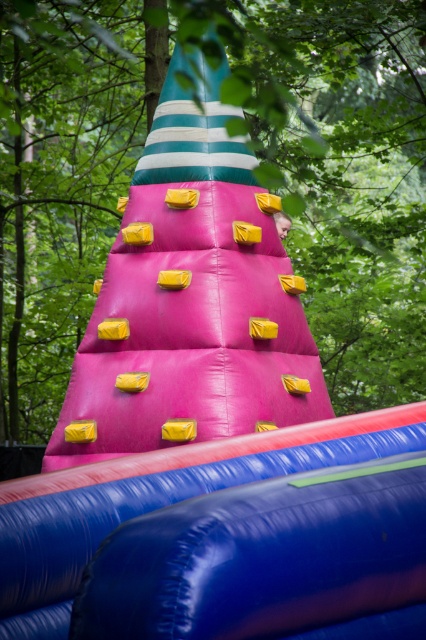
Does green matte tree at center appear over smooth skin head at center?

Yes, green matte tree at center is above smooth skin head at center.

Who is positioned more to the left, green matte tree at center or smooth skin head at center?

Positioned to the left is green matte tree at center.

Between point (17, 424) and point (285, 212), which one is positioned behind?

Point (17, 424)

This screenshot has height=640, width=426. In order to click on green matte tree at center in this screenshot , I will do `click(340, 170)`.

Does blue rubber slide at lower center have a greater height compared to smooth skin head at center?

Yes.

Does blue rubber slide at lower center appear over smooth skin head at center?

No.

The height and width of the screenshot is (640, 426). What do you see at coordinates (227, 538) in the screenshot? I see `blue rubber slide at lower center` at bounding box center [227, 538].

You are a GUI agent. You are given a task and a screenshot of the screen. Output one action in this format:
    pyautogui.click(x=<x>, y=<y>)
    Task: Click on the blue rubber slide at lower center
    
    Given the screenshot: What is the action you would take?
    click(x=227, y=538)

What do you see at coordinates (340, 170) in the screenshot? The image size is (426, 640). I see `green matte tree at center` at bounding box center [340, 170].

Can you confirm if green matte tree at center is shorter than blue rubber slide at lower center?

In fact, green matte tree at center may be taller than blue rubber slide at lower center.

Is point (65, 138) positioned behind point (146, 628)?

That is True.

Locate an element on the screen. The width and height of the screenshot is (426, 640). green matte tree at center is located at coordinates (340, 170).